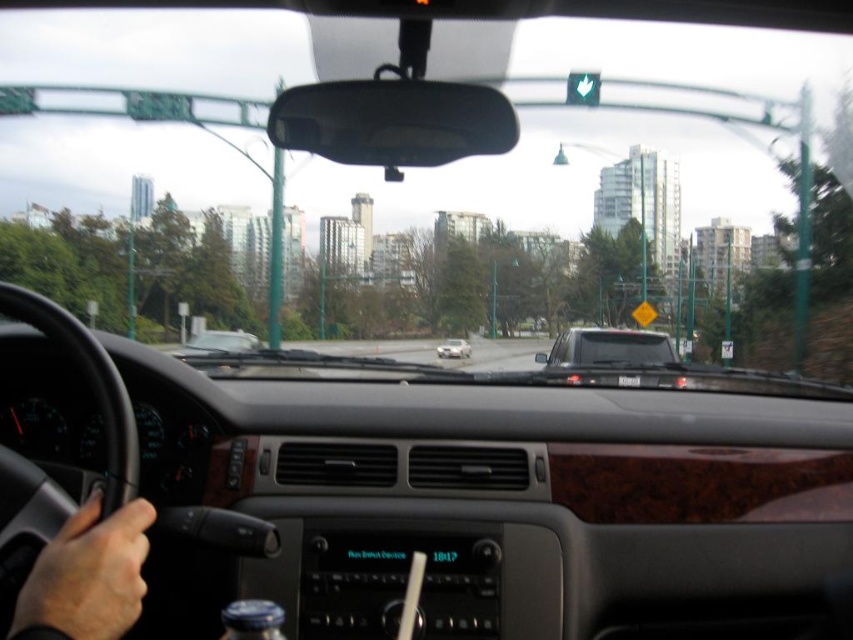
You are driving a car and see the green matte traffic light at upper center and the satin silver sedan at center through the windshield. Which object appears smaller in the scene?

The green matte traffic light at upper center appears smaller than the satin silver sedan at center in the scene.

You are a passenger in the car and want to check the time on the digital clock on the dashboard. The smooth skin hand at lower left is blocking your view. Can you reach over to move it without stretching too far?

The smooth skin hand at lower left is 97.99 centimeters away from viewer. Since the hand is only about 98 cm away, you can easily reach over to move it without stretching too far.

You are a passenger in the car and you see the smooth skin hand at lower left and the matte black car at center through the windshield. Which object is nearer to you?

The smooth skin hand at lower left is closer to the viewer than the matte black car at center.